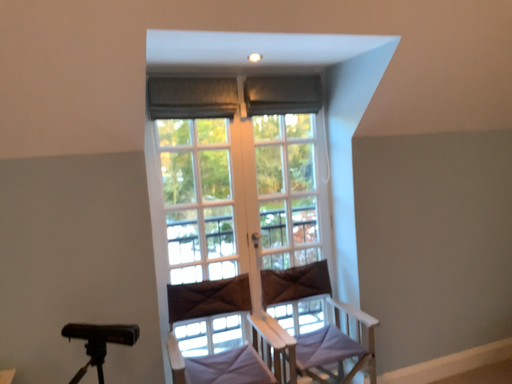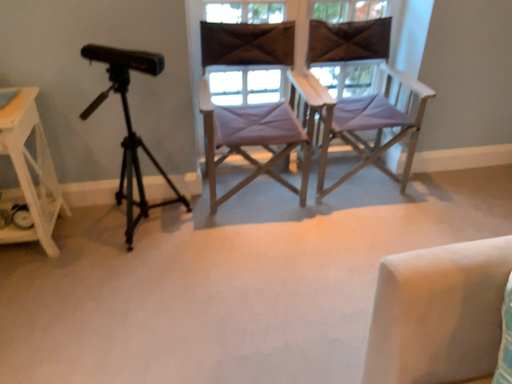
Question: Which way did the camera rotate in the video?

Choices:
 (A) rotated upward
 (B) rotated downward

Answer: (B)